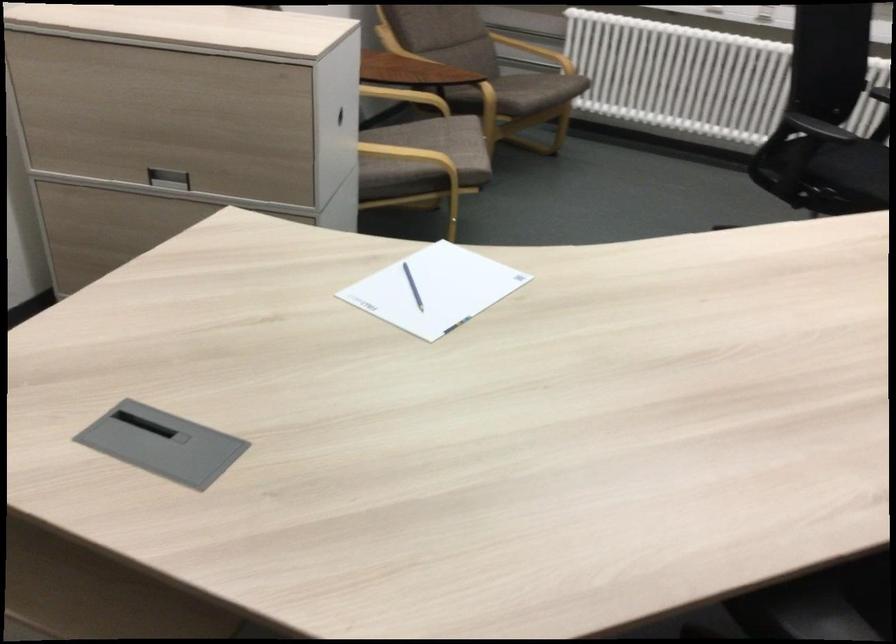
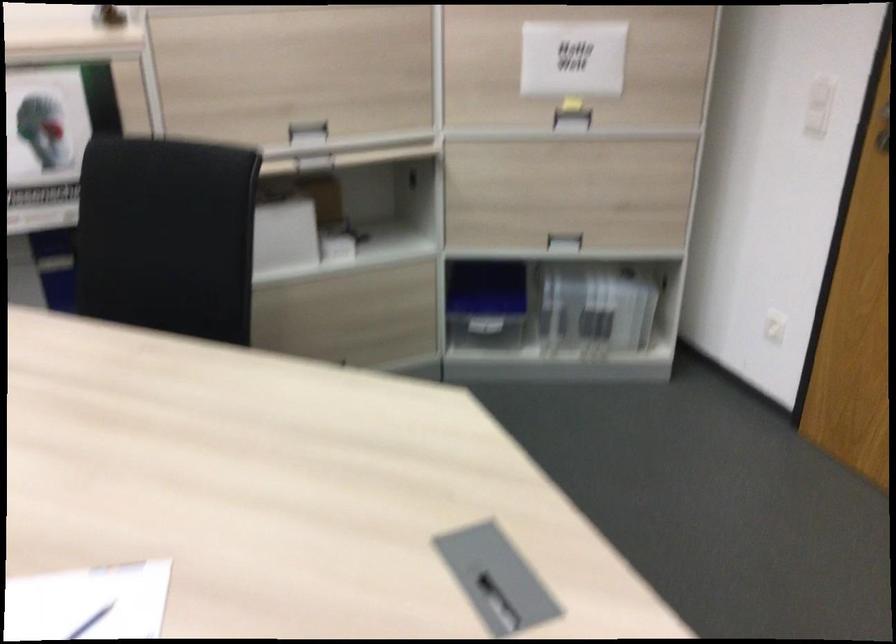
Find the pixel in the second image that matches pixel 108 476 in the first image.

(497, 603)